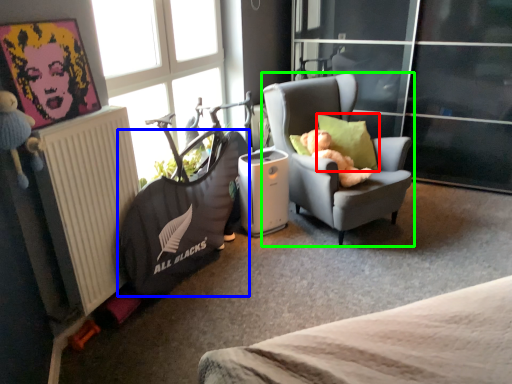
Question: Which is nearer to the pillow (highlighted by a red box)? bean bag chair (highlighted by a blue box) or chair (highlighted by a green box).

Choices:
 (A) bean bag chair
 (B) chair

Answer: (B)